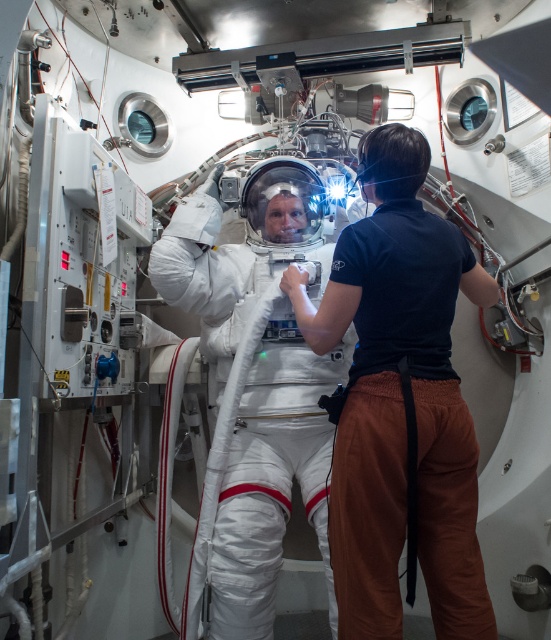
Is white fabric spacesuit at center shorter than white smooth spacesuit at center?

Correct, white fabric spacesuit at center is not as tall as white smooth spacesuit at center.

Which is behind, point (451, 637) or point (250, 250)?

The point (250, 250) is behind.

What are the coordinates of `white fabric spacesuit at center` in the screenshot? It's located at (399, 401).

Locate an element on the screen. The width and height of the screenshot is (551, 640). white fabric spacesuit at center is located at coordinates (399, 401).